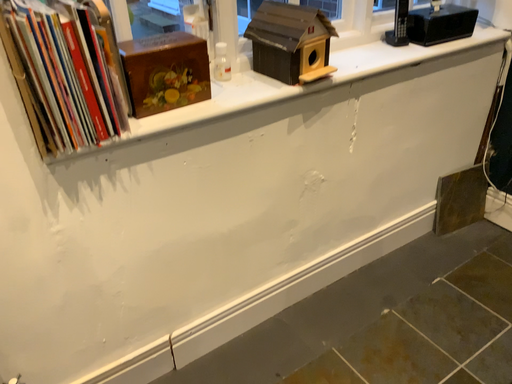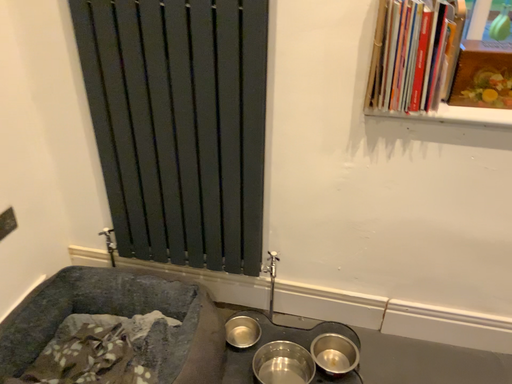
Question: How did the camera likely rotate when shooting the video?

Choices:
 (A) rotated right
 (B) rotated left

Answer: (B)